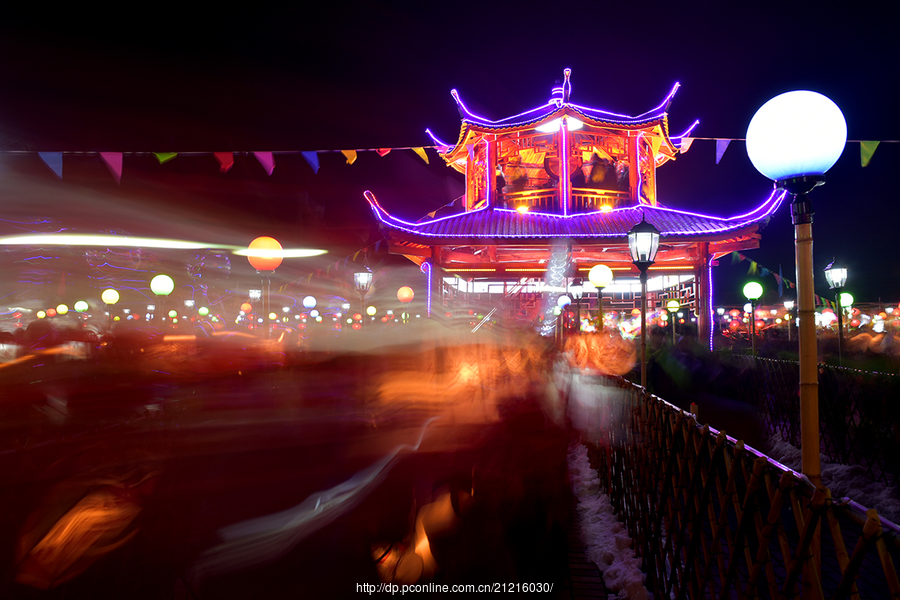
Identify the location of round-shaped light. The image size is (900, 600). point(769,142).